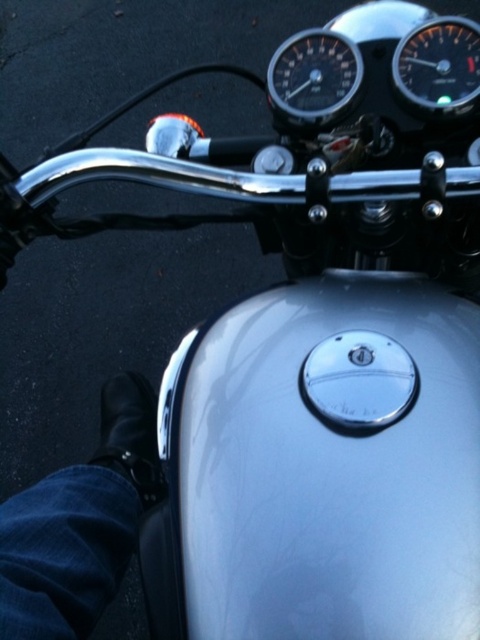
You are a mechanic inspecting a motorcycle. You notice a black leather shoe at lower left and a shiny black speedometer at upper center. Which object is wider?

The black leather shoe at lower left is wider than the shiny black speedometer at upper center.

You are a mechanic working on the motorcycle. You need to install a new speedometer cable that connects the shiny black speedometer at upper center to the black glossy speedometer at upper right. What is the minimum length of cable you should use to ensure it reaches between the two?

The distance between the shiny black speedometer at upper center and the black glossy speedometer at upper right is 4.14 inches, so the minimum cable length required is at least 4.14 inches to ensure it reaches.

You are a photographer trying to capture the motorcycle from a specific angle. You notice a black leather shoe at lower left in the frame. To ensure the shoe doesn not appear in your shot, where should you position yourself relative to the motorcycle?

To avoid capturing the black leather shoe at lower left, position yourself to the right side of the motorcycle, as the shoe is located at the lower left corner of the frame at point [80,524].